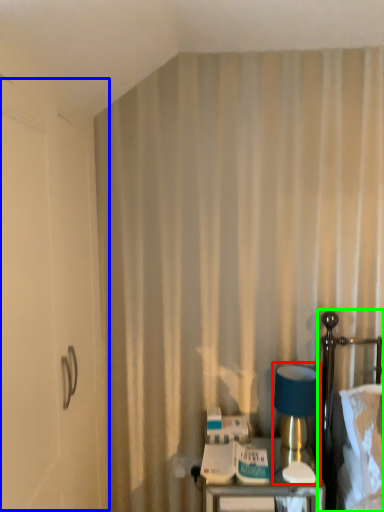
Question: Which object is the farthest from table lamp (highlighted by a red box)? Choose among these: screen door (highlighted by a blue box) or bed (highlighted by a green box).

Choices:
 (A) screen door
 (B) bed

Answer: (A)